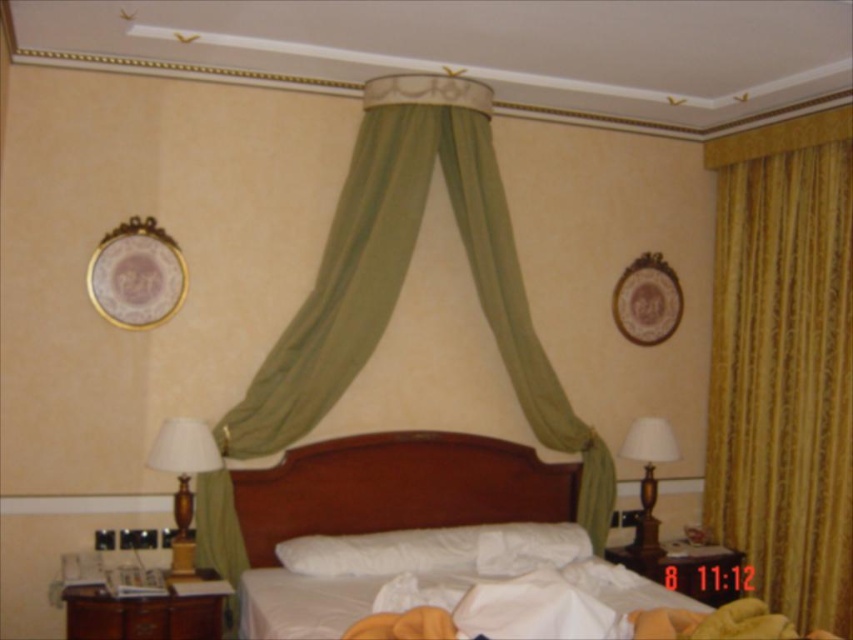
You are a window installer assessing the room. The gold textured curtain at right and the green sheer curtain at center are both hanging in the same window. Which curtain would you say is taller?

The gold textured curtain at right is much taller than the green sheer curtain at center.